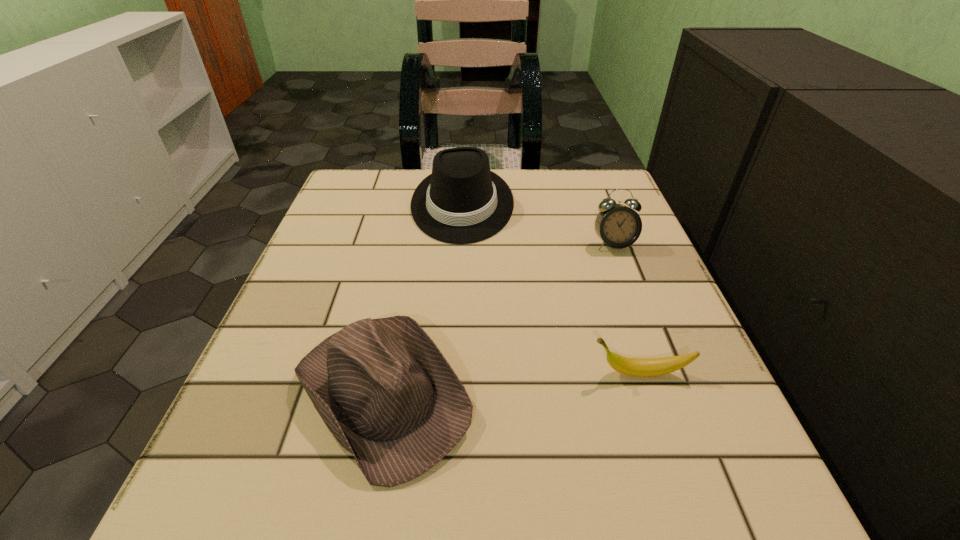
This screenshot has width=960, height=540. In the image, there is a desktop. Find the location of `free region at the near left corner`. free region at the near left corner is located at coordinates pyautogui.click(x=198, y=478).

Locate an element on the screen. The width and height of the screenshot is (960, 540). vacant region at the far right corner is located at coordinates (563, 198).

At what (x,y) coordinates should I click in order to perform the action: click on vacant space in between the farther fedora and the alarm clock. Please return your answer as a coordinate pair (x, y). This screenshot has width=960, height=540. Looking at the image, I should click on (538, 225).

The image size is (960, 540). I want to click on empty space between the nearer fedora and the alarm clock, so click(498, 318).

This screenshot has width=960, height=540. In order to click on blank region between the nearer fedora and the farther fedora in this screenshot , I will do `click(423, 298)`.

Locate an element on the screen. vacant region between the banana and the nearer fedora is located at coordinates (512, 382).

The image size is (960, 540). In order to click on empty space that is in between the nearer fedora and the farther fedora in this screenshot , I will do `click(423, 298)`.

You are a GUI agent. You are given a task and a screenshot of the screen. Output one action in this format:
    pyautogui.click(x=<x>, y=<y>)
    Task: Click on the vacant area that lies between the farther fedora and the shortest object
    
    Given the screenshot: What is the action you would take?
    pyautogui.click(x=551, y=289)

This screenshot has height=540, width=960. What are the coordinates of `free point between the alarm clock and the nearer fedora` in the screenshot? It's located at (498, 318).

This screenshot has width=960, height=540. I want to click on vacant space that's between the farther fedora and the shortest object, so click(551, 289).